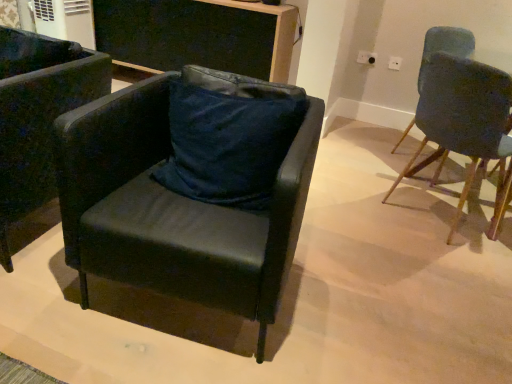
Find the location of `black leather chair at left, acting as the 3th chair starting from the right`. black leather chair at left, acting as the 3th chair starting from the right is located at coordinates (38, 116).

Where is `velvet dark blue chair at right, placed as the 1th chair when sorted from right to left`? velvet dark blue chair at right, placed as the 1th chair when sorted from right to left is located at coordinates (464, 121).

What do you see at coordinates (229, 136) in the screenshot? This screenshot has height=384, width=512. I see `dark blue fabric pillow at center` at bounding box center [229, 136].

Where is `white plastic power outlet at upper right, the 2th power outlet viewed from the left`? Image resolution: width=512 pixels, height=384 pixels. white plastic power outlet at upper right, the 2th power outlet viewed from the left is located at coordinates (394, 63).

At what (x,y) coordinates should I click in order to perform the action: click on black matte desk at upper center. Please return your answer as a coordinate pair (x, y). The height and width of the screenshot is (384, 512). Looking at the image, I should click on (197, 35).

I want to click on black leather chair at center, arranged as the 2th chair when viewed from the left, so click(173, 210).

Choose the correct answer: Is velvet dark blue chair at right, acting as the third chair starting from the left, inside black matte desk at upper center or outside it?

velvet dark blue chair at right, acting as the third chair starting from the left, is located beyond the bounds of black matte desk at upper center.

From the image's perspective, which one is positioned higher, velvet dark blue chair at right, acting as the third chair starting from the left, or black matte desk at upper center?

black matte desk at upper center is shown above in the image.

Between velvet dark blue chair at right, acting as the third chair starting from the left, and black matte desk at upper center, which one is positioned behind?

black matte desk at upper center is behind.

The height and width of the screenshot is (384, 512). What are the coordinates of `pillow that appears on the left of velvet dark blue chair at right, placed as the 1th chair when sorted from right to left` in the screenshot? It's located at (229, 136).

From the image's perspective, is dark blue fabric pillow at center over velvet dark blue chair at right, placed as the 1th chair when sorted from right to left?

No, from the image's perspective, dark blue fabric pillow at center is not over velvet dark blue chair at right, placed as the 1th chair when sorted from right to left.

Does point (263, 85) come behind point (461, 60)?

No, it is in front of (461, 60).

Between dark blue fabric pillow at center and black leather chair at left, which ranks as the first chair in left-to-right order, which one appears on the left side from the viewer's perspective?

Positioned to the left is black leather chair at left, which ranks as the first chair in left-to-right order.

In terms of height, does dark blue fabric pillow at center look taller or shorter compared to black leather chair at left, which ranks as the first chair in left-to-right order?

In the image, dark blue fabric pillow at center appears to be shorter than black leather chair at left, which ranks as the first chair in left-to-right order.

Is dark blue fabric pillow at center inside the boundaries of black leather chair at left, which ranks as the first chair in left-to-right order, or outside?

The correct answer is: outside.

Is dark blue fabric pillow at center in contact with black leather chair at left, which ranks as the first chair in left-to-right order?

They are not placed beside each other.

Which object is wider, white plastic power outlet at upper right, which appears as the 1th power outlet when viewed from the right, or white plastic power outlet at upper center, acting as the second power outlet starting from the right?

white plastic power outlet at upper right, which appears as the 1th power outlet when viewed from the right.

This screenshot has width=512, height=384. I want to click on power outlet above the white plastic power outlet at upper right, the 2th power outlet viewed from the left (from a real-world perspective), so click(366, 57).

Is white plastic power outlet at upper right, the 2th power outlet viewed from the left, in front of or behind white plastic power outlet at upper center, which is the 1th power outlet in left-to-right order, in the image?

Clearly, white plastic power outlet at upper right, the 2th power outlet viewed from the left, is in front of white plastic power outlet at upper center, which is the 1th power outlet in left-to-right order.

Is point (396, 60) positioned in front of point (368, 61)?

Yes, point (396, 60) is closer to viewer.

From the picture: Which is in front, white plastic power outlet at upper right, which appears as the 1th power outlet when viewed from the right, or dark blue fabric pillow at center?

A: dark blue fabric pillow at center is closer to the camera.

Between white plastic power outlet at upper right, the 2th power outlet viewed from the left, and dark blue fabric pillow at center, which one has larger size?

Bigger between the two is dark blue fabric pillow at center.

Is point (388, 66) positioned before point (207, 165)?

No, (388, 66) is behind (207, 165).

From the image's perspective, is white plastic power outlet at upper right, the 2th power outlet viewed from the left, located above or below velvet dark blue chair at right, acting as the third chair starting from the left?

From the image's perspective, white plastic power outlet at upper right, the 2th power outlet viewed from the left, appears above velvet dark blue chair at right, acting as the third chair starting from the left.

Measure the distance between white plastic power outlet at upper right, which appears as the 1th power outlet when viewed from the right, and velvet dark blue chair at right, acting as the third chair starting from the left.

white plastic power outlet at upper right, which appears as the 1th power outlet when viewed from the right, and velvet dark blue chair at right, acting as the third chair starting from the left, are 1.44 meters apart from each other.

The height and width of the screenshot is (384, 512). I want to click on power outlet that is the 1st object located behind the velvet dark blue chair at right, acting as the third chair starting from the left, so click(394, 63).

Considering the sizes of objects velvet dark blue chair at right, acting as the third chair starting from the left, and white plastic power outlet at upper right, the 2th power outlet viewed from the left, in the image provided, who is wider, velvet dark blue chair at right, acting as the third chair starting from the left, or white plastic power outlet at upper right, the 2th power outlet viewed from the left,?

velvet dark blue chair at right, acting as the third chair starting from the left.

Considering the positions of points (425, 61) and (398, 65), is point (425, 61) farther from camera compared to point (398, 65)?

No, it is not.

Can you confirm if velvet dark blue chair at right, acting as the third chair starting from the left, is bigger than white plastic power outlet at upper right, the 2th power outlet viewed from the left?

Correct, velvet dark blue chair at right, acting as the third chair starting from the left, is larger in size than white plastic power outlet at upper right, the 2th power outlet viewed from the left.

Locate an element on the screen. desk behind the velvet dark blue chair at right, placed as the 1th chair when sorted from right to left is located at coordinates (197, 35).

Find the location of a particular element. pillow that is in front of the velvet dark blue chair at right, acting as the third chair starting from the left is located at coordinates (229, 136).

Considering their positions, is velvet dark blue chair at right, acting as the third chair starting from the left, positioned closer to dark blue fabric pillow at center than white plastic power outlet at upper center, which is the 1th power outlet in left-to-right order?

velvet dark blue chair at right, acting as the third chair starting from the left.

Which object lies nearer to the anchor point black matte desk at upper center, black leather chair at center, arranged as the 2th chair when viewed from the left, or velvet dark blue chair at right, placed as the 1th chair when sorted from right to left?

The object closer to black matte desk at upper center is velvet dark blue chair at right, placed as the 1th chair when sorted from right to left.

When comparing their distances from black leather chair at center, which is the 2th chair in right-to-left order, does black matte desk at upper center or black leather chair at left, acting as the 3th chair starting from the right, seem closer?

black leather chair at left, acting as the 3th chair starting from the right.

Based on the photo, estimate the real-world distances between objects in this image. Which object is further from white plastic power outlet at upper right, which appears as the 1th power outlet when viewed from the right, black matte desk at upper center or velvet dark blue chair at right, placed as the 1th chair when sorted from right to left?

black matte desk at upper center lies further to white plastic power outlet at upper right, which appears as the 1th power outlet when viewed from the right, than the other object.

From the image, which object appears to be nearer to white plastic power outlet at upper right, the 2th power outlet viewed from the left, dark blue fabric pillow at center or white plastic power outlet at upper center, acting as the second power outlet starting from the right?

white plastic power outlet at upper center, acting as the second power outlet starting from the right, lies closer to white plastic power outlet at upper right, the 2th power outlet viewed from the left, than the other object.

When comparing their distances from black leather chair at left, acting as the 3th chair starting from the right, does white plastic power outlet at upper center, which is the 1th power outlet in left-to-right order, or velvet dark blue chair at right, placed as the 1th chair when sorted from right to left, seem further?

Based on the image, white plastic power outlet at upper center, which is the 1th power outlet in left-to-right order, appears to be further to black leather chair at left, acting as the 3th chair starting from the right.

Estimate the real-world distances between objects in this image. Which object is closer to dark blue fabric pillow at center, white plastic power outlet at upper right, the 2th power outlet viewed from the left, or black leather chair at left, acting as the 3th chair starting from the right?

Based on the image, black leather chair at left, acting as the 3th chair starting from the right, appears to be nearer to dark blue fabric pillow at center.

When comparing their distances from white plastic power outlet at upper right, the 2th power outlet viewed from the left, does velvet dark blue chair at right, acting as the third chair starting from the left, or black leather chair at center, which is the 2th chair in right-to-left order, seem closer?

velvet dark blue chair at right, acting as the third chair starting from the left, lies closer to white plastic power outlet at upper right, the 2th power outlet viewed from the left, than the other object.

The height and width of the screenshot is (384, 512). Identify the location of power outlet positioned between dark blue fabric pillow at center and white plastic power outlet at upper center, which is the 1th power outlet in left-to-right order, from near to far. (394, 63).

The height and width of the screenshot is (384, 512). I want to click on desk between black leather chair at left, which ranks as the first chair in left-to-right order, and white plastic power outlet at upper right, the 2th power outlet viewed from the left, in the horizontal direction, so pos(197,35).

Locate an element on the screen. This screenshot has height=384, width=512. desk located between black leather chair at center, which is the 2th chair in right-to-left order, and white plastic power outlet at upper center, acting as the second power outlet starting from the right, in the depth direction is located at coordinates (197, 35).

This screenshot has height=384, width=512. I want to click on power outlet located between black leather chair at left, acting as the 3th chair starting from the right, and white plastic power outlet at upper right, which appears as the 1th power outlet when viewed from the right, in the left-right direction, so click(x=366, y=57).